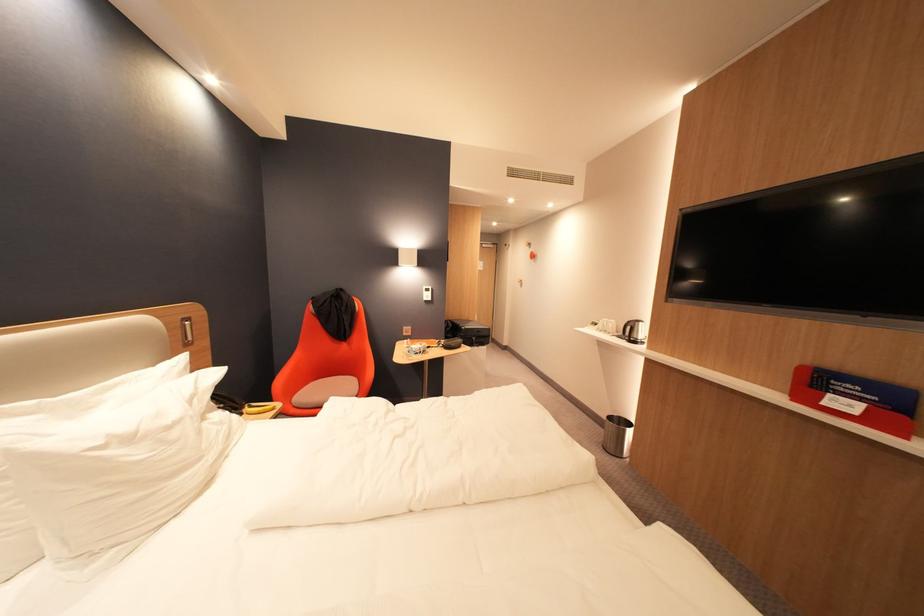
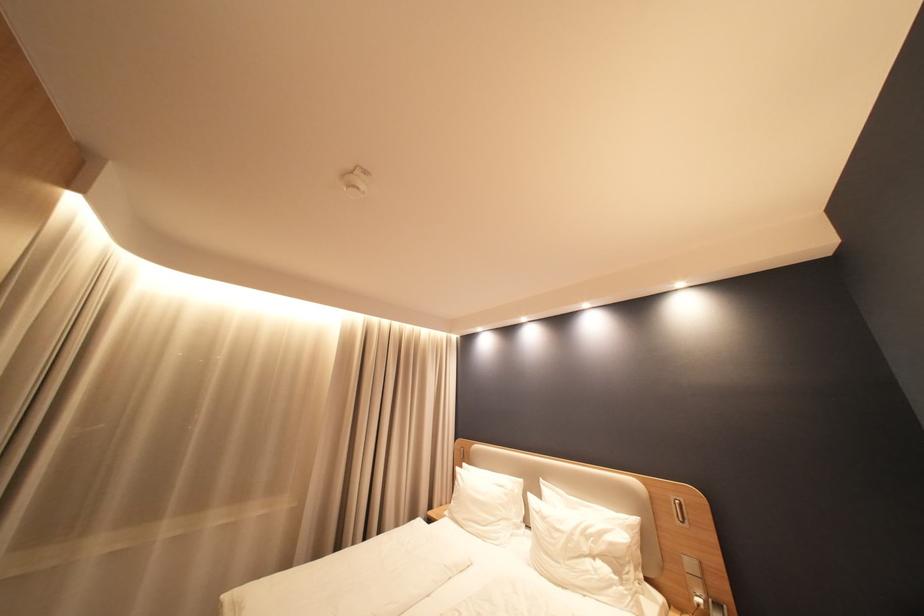
Locate, in the second image, the point that corresponds to the point at 108,444 in the first image.

(546, 511)